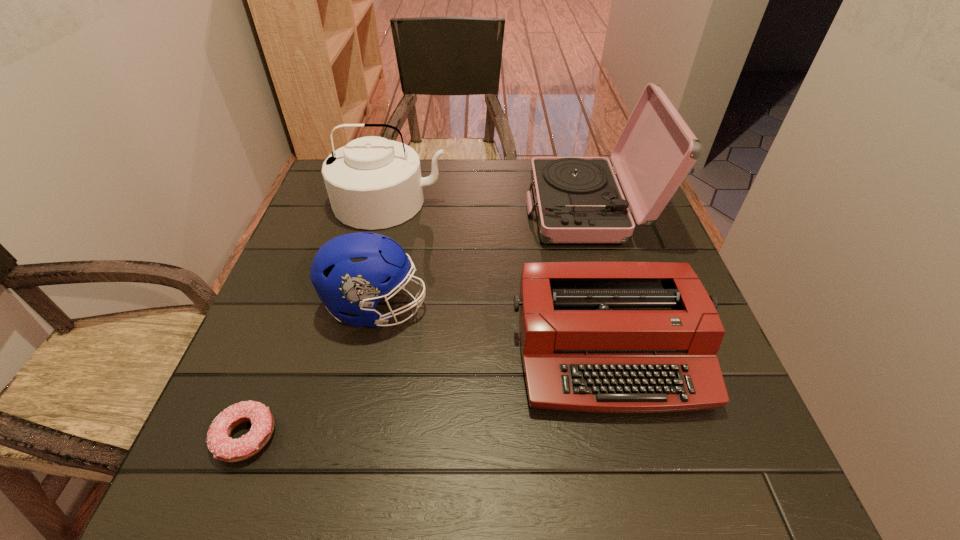
Find the location of a particular element. Image resolution: width=960 pixels, height=540 pixels. free spot between the doughnut and the kettle is located at coordinates (318, 319).

I want to click on free spot between the second tallest object and the record player, so click(490, 206).

This screenshot has width=960, height=540. Find the location of `vacant area that lies between the typewriter and the doughnut`. vacant area that lies between the typewriter and the doughnut is located at coordinates (427, 393).

Image resolution: width=960 pixels, height=540 pixels. What are the coordinates of `vacant area between the football helmet and the typewriter` in the screenshot? It's located at (492, 329).

The width and height of the screenshot is (960, 540). Identify the location of free space between the football helmet and the shortest object. (311, 372).

Locate an element on the screen. This screenshot has width=960, height=540. unoccupied position between the football helmet and the tallest object is located at coordinates (483, 258).

Locate an element on the screen. This screenshot has width=960, height=540. blank region between the second tallest object and the typewriter is located at coordinates 499,276.

At what (x,y) coordinates should I click in order to perform the action: click on vacant region between the shortest object and the typewriter. Please return your answer as a coordinate pair (x, y). Looking at the image, I should click on (427, 393).

Point out which object is positioned as the third nearest to the record player. Please provide its 2D coordinates. Your answer should be formatted as a tuple, i.e. [(x, y)], where the tuple contains the x and y coordinates of a point satisfying the conditions above.

[(351, 273)]

Find the location of a particular element. The image size is (960, 540). object that can be found as the fourth closest to the doughnut is located at coordinates (578, 200).